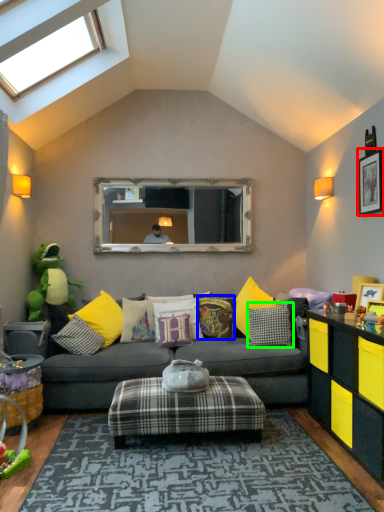
Question: Which object is positioned closest to picture frame (highlighted by a red box)? Select from pillow (highlighted by a blue box) and pillow (highlighted by a green box).

Choices:
 (A) pillow
 (B) pillow

Answer: (B)